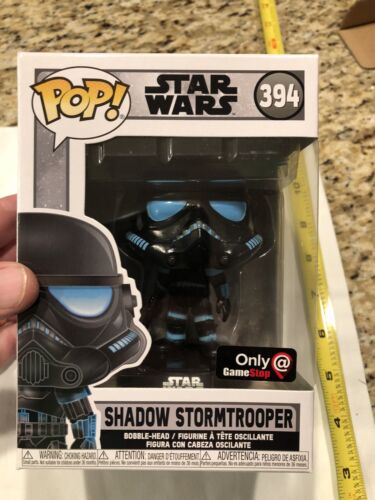
Where is `countertop`? The image size is (375, 500). countertop is located at coordinates (135, 22).